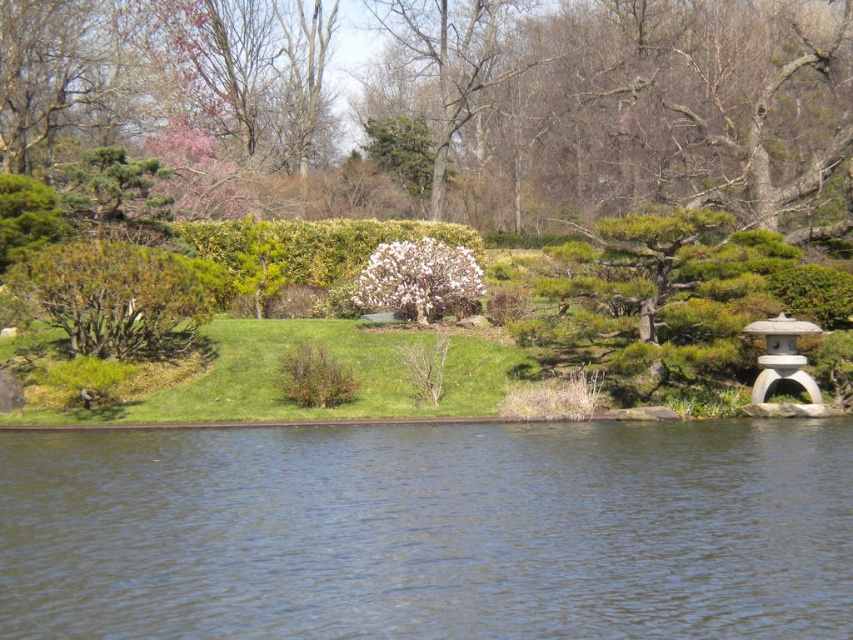
You are standing in the garden and want to place a small statue between the green leafy bush at upper center and the brown textured bush at center. Based on their positions, where should you position the statue to ensure it is between them?

The green leafy bush at upper center is above the brown textured bush at center. To place the statue between them, position it below the green leafy bush at upper center and above the brown textured bush at center.

You are planning to place a small garden statue between the green leafy bush at upper center and the white fluffy bush at center. Based on their widths, which bush should the statue be closer to?

The green leafy bush at upper center might be wider than the white fluffy bush at center, so the statue should be placed closer to the white fluffy bush at center to balance the space.